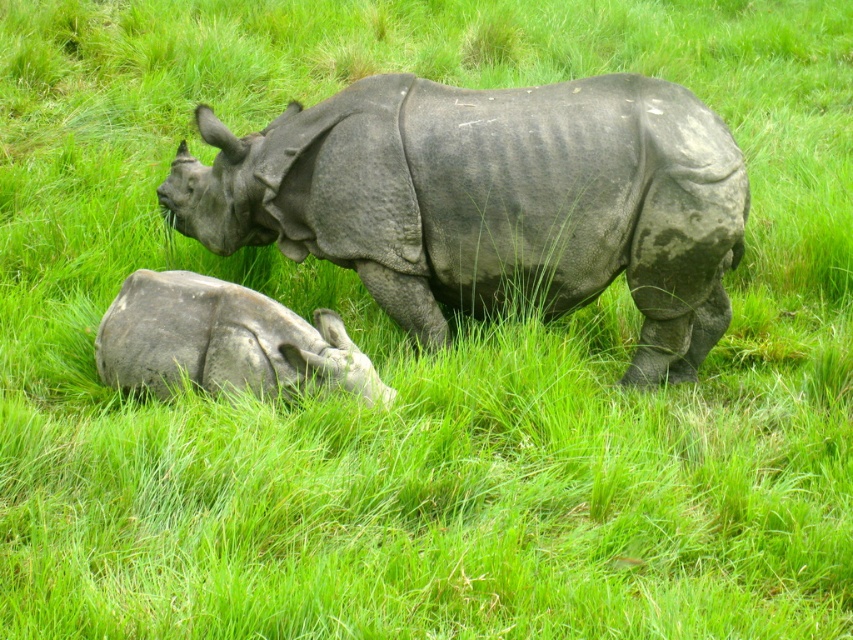
You are a wildlife photographer aiming to capture the gray textured rhino at center in your shot. Your camera has a focus point at coordinates 0.316, 0.577. Will this focus point align with the rhino?

Yes, the gray textured rhino at center is located at 2D coordinates [491,202], so the focus point will align perfectly with it.

You are a drone operator trying to capture aerial footage of the two rhinoceroses. You have two camera points marked as point 1 and point 2. Point 1 is at coordinates point (247,234) and point 2 is at coordinates point (149,284). If you want to film the rhinos from the point that is closer to the front of the scene, which point should you choose?

Point 2 is closer to the front of the scene because point 1 is behind point 2 according to their coordinates.